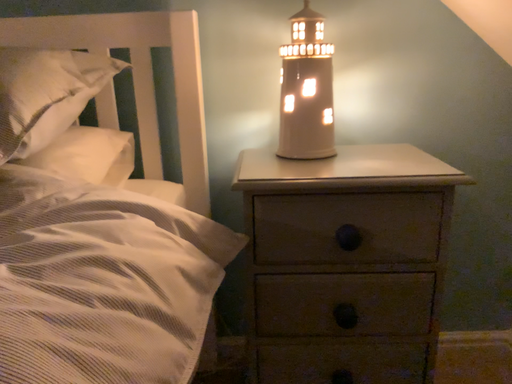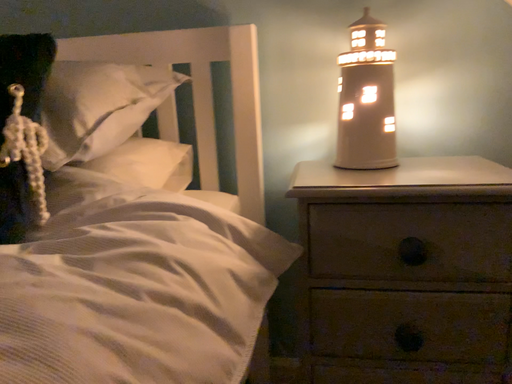
Question: Which way did the camera rotate in the video?

Choices:
 (A) rotated right
 (B) rotated left

Answer: (B)